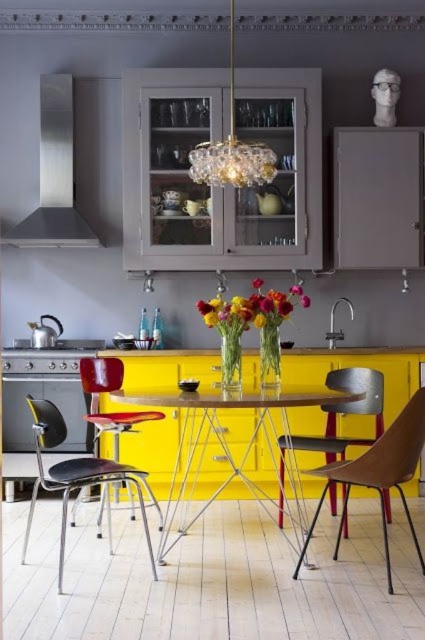
You are standing in the kitchen and want to move from the sink to the metallic silver chair at center. Is the stainless steel oven at left blocking your path?

The metallic silver chair at center is behind the stainless steel oven at left, so the oven is blocking the path to the chair.

You are a chef preparing to place a large pot on the yellow glossy table at center and the stainless steel oven at left. Which surface can accommodate the pot without it being too low to the ground?

The yellow glossy table at center has a greater height compared to the stainless steel oven at left, so placing the large pot on the yellow glossy table at center would provide a more suitable height to avoid it being too low to the ground.

You are a delivery person who needs to place a 5.5 feet long package between the crystal chandelier at upper center and the metallic red chair at left. Can the package fit in the space between them?

The crystal chandelier at upper center is 5.39 feet from the metallic red chair at left, so the 5.5 feet long package cannot fit between them as it is slightly longer than the available space.